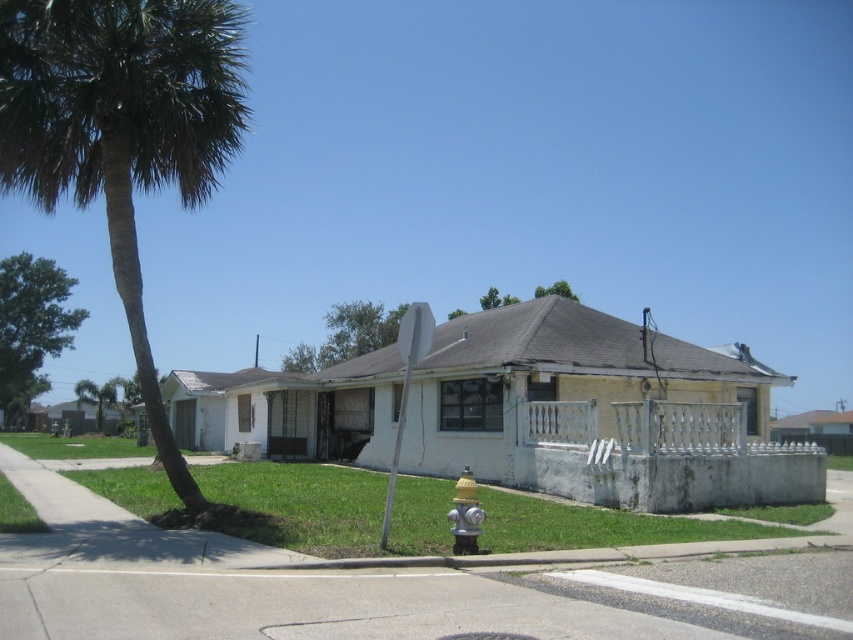
Which of these two, green leafy palm tree at left or yellow metallic fire hydrant at lower center, stands shorter?

yellow metallic fire hydrant at lower center is shorter.

Image resolution: width=853 pixels, height=640 pixels. I want to click on green leafy palm tree at left, so click(x=122, y=129).

At what (x,y) coordinates should I click in order to perform the action: click on green leafy palm tree at left. Please return your answer as a coordinate pair (x, y). This screenshot has width=853, height=640. Looking at the image, I should click on click(x=122, y=129).

How much distance is there between green leafy tree at upper left and yellow metallic fire hydrant at lower center?

A distance of 59.24 meters exists between green leafy tree at upper left and yellow metallic fire hydrant at lower center.

Does green leafy tree at upper left have a lesser height compared to yellow metallic fire hydrant at lower center?

No.

This screenshot has width=853, height=640. What do you see at coordinates (32, 326) in the screenshot?
I see `green leafy tree at upper left` at bounding box center [32, 326].

The width and height of the screenshot is (853, 640). I want to click on green leafy tree at upper left, so click(x=32, y=326).

Is green leafy palm tree at left below green leafy tree at upper center?

Indeed, green leafy palm tree at left is positioned under green leafy tree at upper center.

Does green leafy palm tree at left have a larger size compared to green leafy tree at upper center?

No, green leafy palm tree at left is not bigger than green leafy tree at upper center.

Find the location of `green leafy palm tree at left`. green leafy palm tree at left is located at coordinates (122, 129).